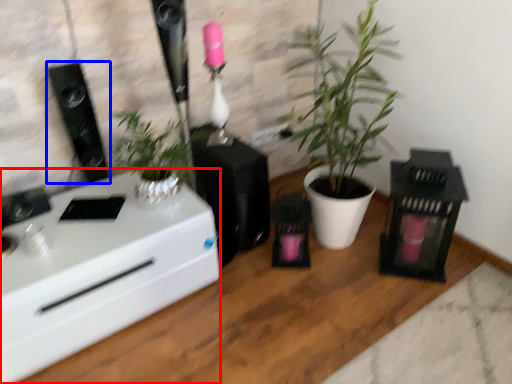
Question: Which of the following is the closest to the observer, desk (highlighted by a red box) or loudspeaker (highlighted by a blue box)?

Choices:
 (A) desk
 (B) loudspeaker

Answer: (A)